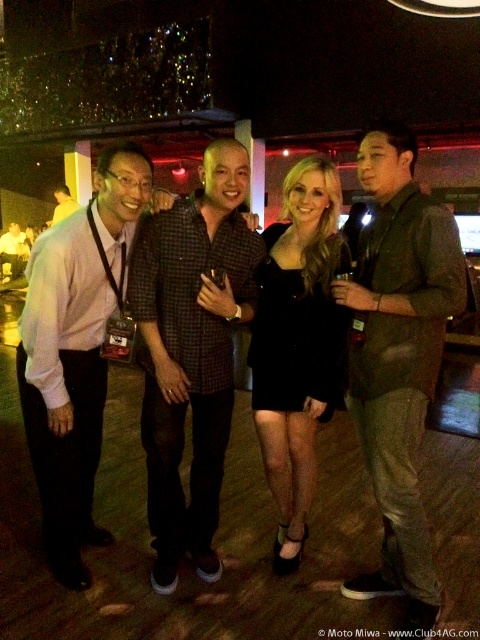
Question: Does shiny dark gray suit at right appear over matte black shirt at left?

Choices:
 (A) yes
 (B) no

Answer: (B)

Question: Which point appears closest to the camera in this image?

Choices:
 (A) (414, 189)
 (B) (68, 216)
 (C) (164, 300)

Answer: (A)

Question: Which object is closer to the camera taking this photo?

Choices:
 (A) black satin dress at center
 (B) checkered fabric shirt at center
 (C) shiny dark gray suit at right

Answer: (C)

Question: Is shiny dark gray suit at right to the right of light pink shirt at left from the viewer's perspective?

Choices:
 (A) no
 (B) yes

Answer: (B)

Question: Among these points, which one is farthest from the camera?

Choices:
 (A) (59, 531)
 (B) (257, 330)
 (C) (373, 189)
 (D) (210, 442)

Answer: (B)

Question: Is the position of shiny dark gray suit at right less distant than that of light pink shirt at left?

Choices:
 (A) no
 (B) yes

Answer: (B)